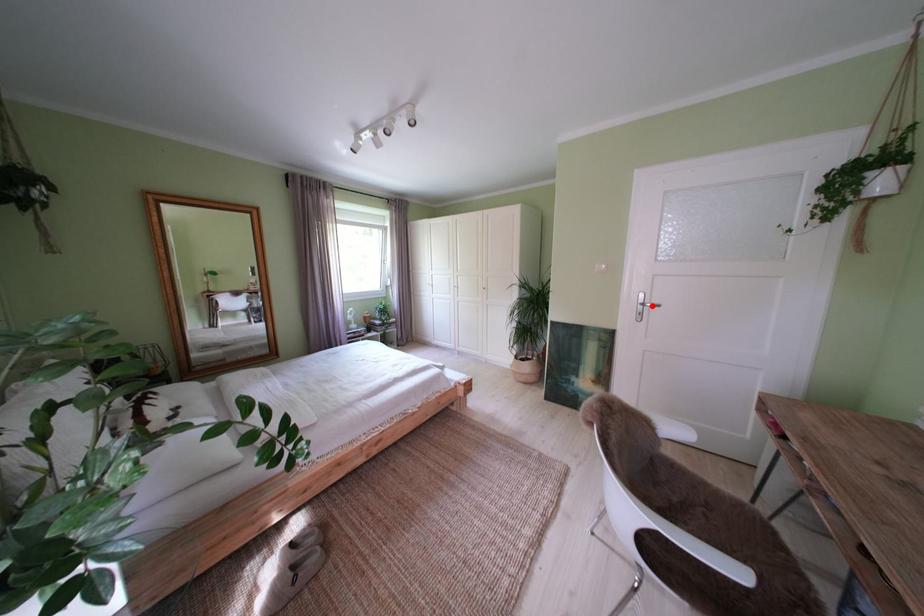
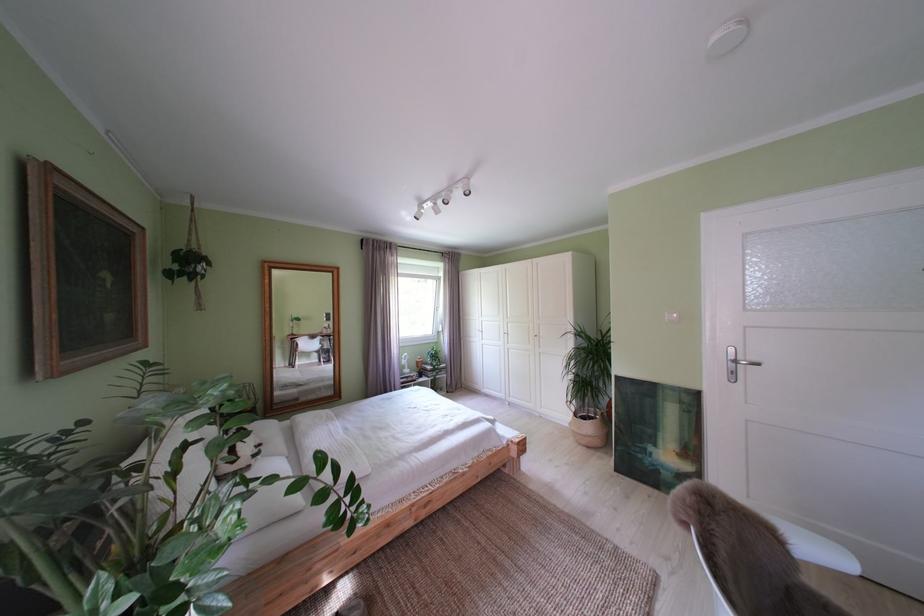
The point at the highlighted location is marked in the first image. Where is the corresponding point in the second image?

(743, 363)